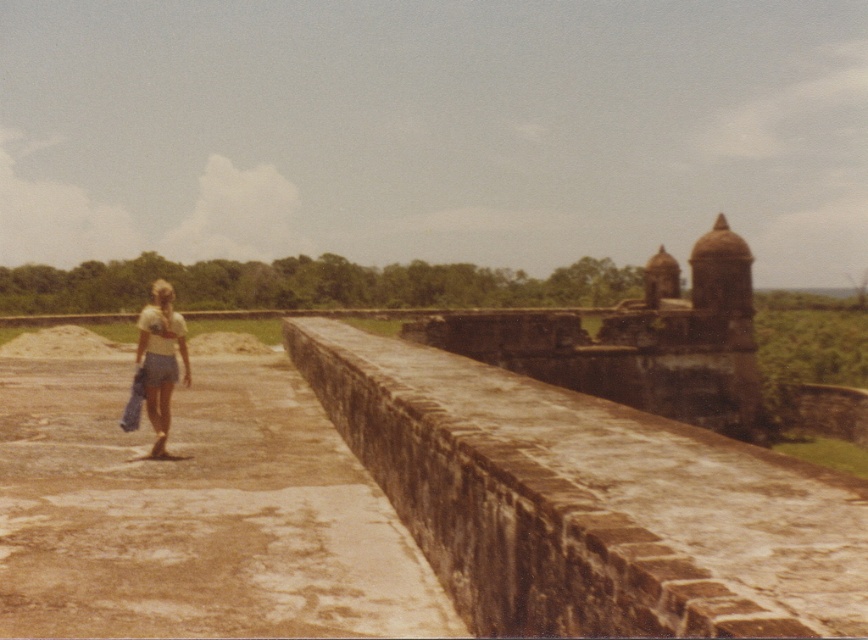
Which of these two, brown stone moat at center or white cotton shirt at center, stands shorter?

With less height is brown stone moat at center.

Does brown stone moat at center lie behind white cotton shirt at center?

No.

Measure the distance between point (490, 508) and camera.

Point (490, 508) and camera are 5.35 meters apart from each other.

At what (x,y) coordinates should I click in order to perform the action: click on brown stone moat at center. Please return your answer as a coordinate pair (x, y). The width and height of the screenshot is (868, 640). Looking at the image, I should click on (589, 500).

Who is shorter, brown stone fort at center or white cotton shirt at center?

white cotton shirt at center

Between brown stone fort at center and white cotton shirt at center, which one appears on the right side from the viewer's perspective?

From the viewer's perspective, brown stone fort at center appears more on the right side.

Which is behind, point (742, 321) or point (140, 340)?

Positioned behind is point (742, 321).

Locate an element on the screen. This screenshot has width=868, height=640. brown stone fort at center is located at coordinates (638, 340).

Can you confirm if brown stone moat at center is positioned to the left of brown stone fort at center?

Correct, you'll find brown stone moat at center to the left of brown stone fort at center.

From the picture: Is brown stone moat at center wider than brown stone fort at center?

Incorrect, brown stone moat at center's width does not surpass brown stone fort at center's.

Identify the location of brown stone moat at center. (589, 500).